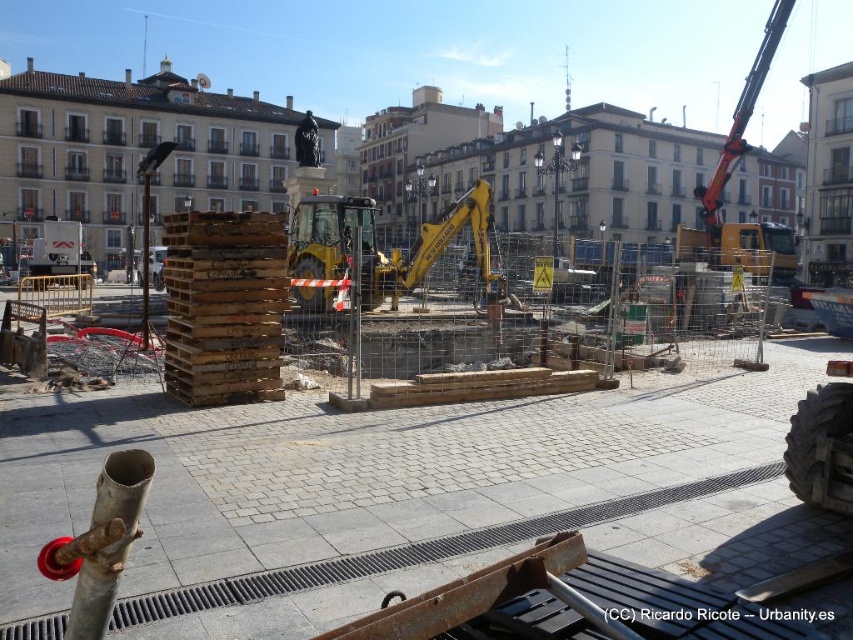
You are a crane operator trying to lift a heavy beam over the bronze statue at center without hitting the yellow metallic excavator at upper right. Based on their heights, which object is more likely to be hit by the beam first?

The yellow metallic excavator at upper right is taller than the bronze statue at center, so the beam would hit the yellow metallic excavator at upper right first if it is lifted over the bronze statue at center.

You are a construction worker who needs to move the yellow metallic excavator at center to the parking lot. However, there is another yellow metallic excavator at upper right above it. Can you safely move the excavator at center without hitting the one above?

The yellow metallic excavator at center is positioned under the yellow metallic excavator at upper right, so moving it might result in a collision. Therefore, you cannot safely move the excavator at center without hitting the one above.